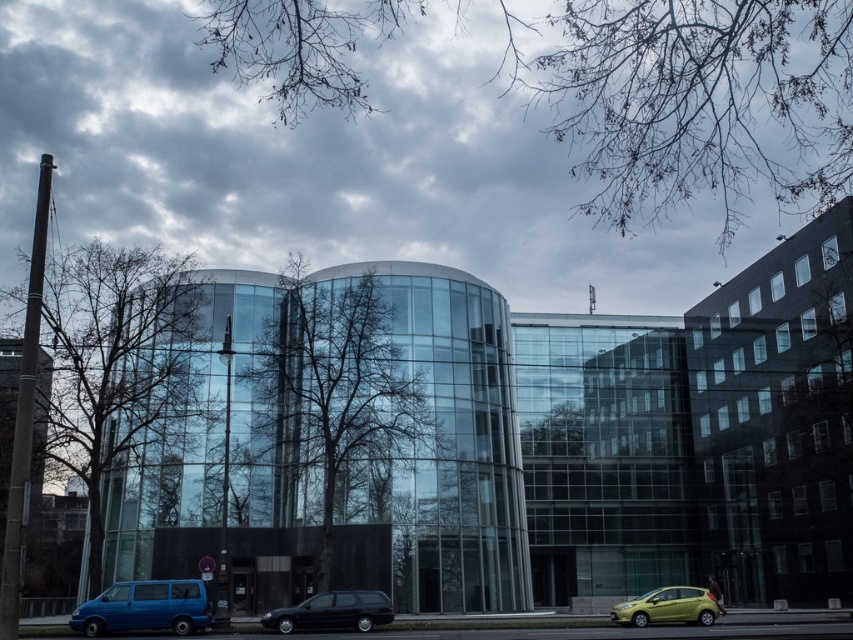
Does blue matte van at lower left appear on the left side of shiny black station wagon at lower center?

Correct, you'll find blue matte van at lower left to the left of shiny black station wagon at lower center.

Is point (108, 595) positioned before point (293, 614)?

Yes, it is in front of point (293, 614).

What are the coordinates of `blue matte van at lower left` in the screenshot? It's located at (144, 608).

Is point (161, 584) positioned after point (682, 616)?

No, (161, 584) is closer to viewer.

Consider the image. Between blue matte van at lower left and metallic yellow car at lower right, which one is positioned higher?

blue matte van at lower left is higher up.

Describe the element at coordinates (144, 608) in the screenshot. The height and width of the screenshot is (640, 853). I see `blue matte van at lower left` at that location.

At what (x,y) coordinates should I click in order to perform the action: click on blue matte van at lower left. Please return your answer as a coordinate pair (x, y). Looking at the image, I should click on (144, 608).

Measure the distance from shiny black station wagon at lower center to metallic yellow car at lower right.

A distance of 12.45 meters exists between shiny black station wagon at lower center and metallic yellow car at lower right.

Looking at this image, who is positioned more to the right, shiny black station wagon at lower center or metallic yellow car at lower right?

Positioned to the right is metallic yellow car at lower right.

Does point (318, 611) lie behind point (612, 608)?

No, (318, 611) is in front of (612, 608).

I want to click on shiny black station wagon at lower center, so click(x=332, y=611).